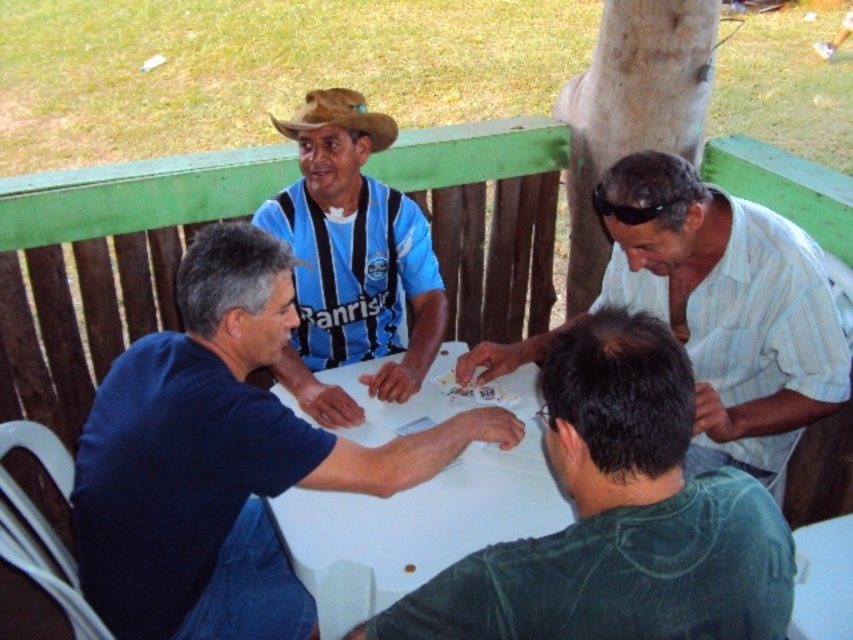
You are a photographer standing behind the group of men at the white table. You want to take a photo that includes both the dark green denim shirt at lower right and the brown woven cowboy hat at center. Which object should you focus on first to ensure both are in frame?

The dark green denim shirt at lower right is much taller than the brown woven cowboy hat at center, so you should focus on the dark green denim shirt at lower right first to ensure both are in frame.

Based on the photo, you are a photographer trying to capture a closeup of the dark green denim shirt at lower right and the white glossy table at center. Since you want to focus on the shirt, which object should you position closer to the camera?

The dark green denim shirt at lower right has a lesser width compared to the white glossy table at center, so to focus on the shirt, you should position the dark green denim shirt at lower right closer to the camera.

You are a photographer positioned behind the dark green denim shirt at lower right. You want to take a closeup shot of the white glossy table at center. Can you reach the table without moving your position? Explain why or why not based on the distance between them.

The dark green denim shirt at lower right is 24.04 inches away from the white glossy table at center. Since 24.04 inches is approximately 2 feet, you can easily reach the table without moving your position as this distance is within arm length.